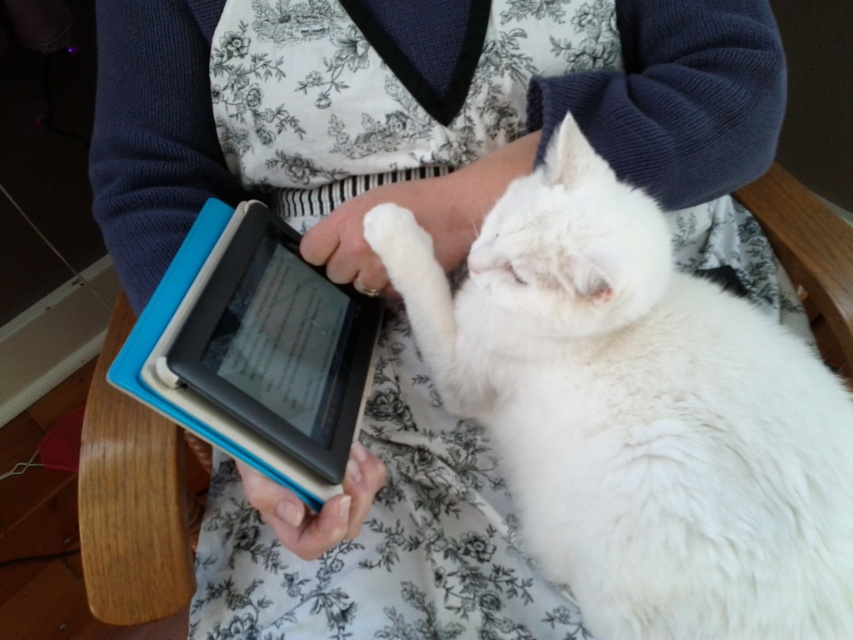
Is white fluffy cat at center behind matte blue tablet at center?

No, white fluffy cat at center is in front of matte blue tablet at center.

Can you confirm if white fluffy cat at center is bigger than matte blue tablet at center?

Indeed, white fluffy cat at center has a larger size compared to matte blue tablet at center.

Is point (734, 524) in front of point (242, 321)?

Yes, point (734, 524) is closer to viewer.

Locate an element on the screen. Image resolution: width=853 pixels, height=640 pixels. white fluffy cat at center is located at coordinates (637, 412).